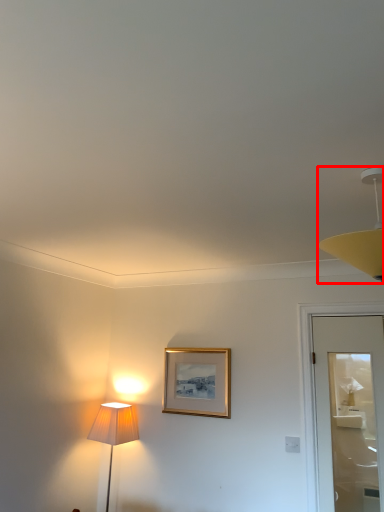
Question: From the image's perspective, what is the correct spatial positioning of lamp (annotated by the red box) in reference to picture frame?

Choices:
 (A) above
 (B) below

Answer: (A)